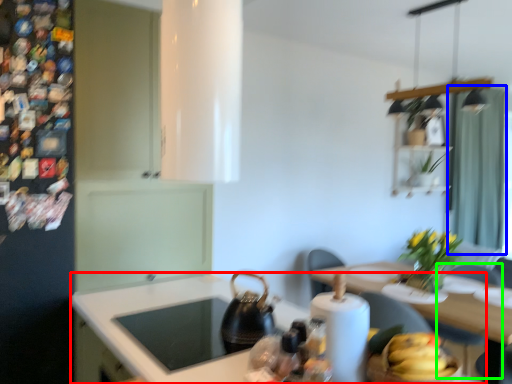
Question: Considering the real-world distances, which object is closest to counter top (highlighted by a red box)? curtain (highlighted by a blue box) or chair (highlighted by a green box).

Choices:
 (A) curtain
 (B) chair

Answer: (B)